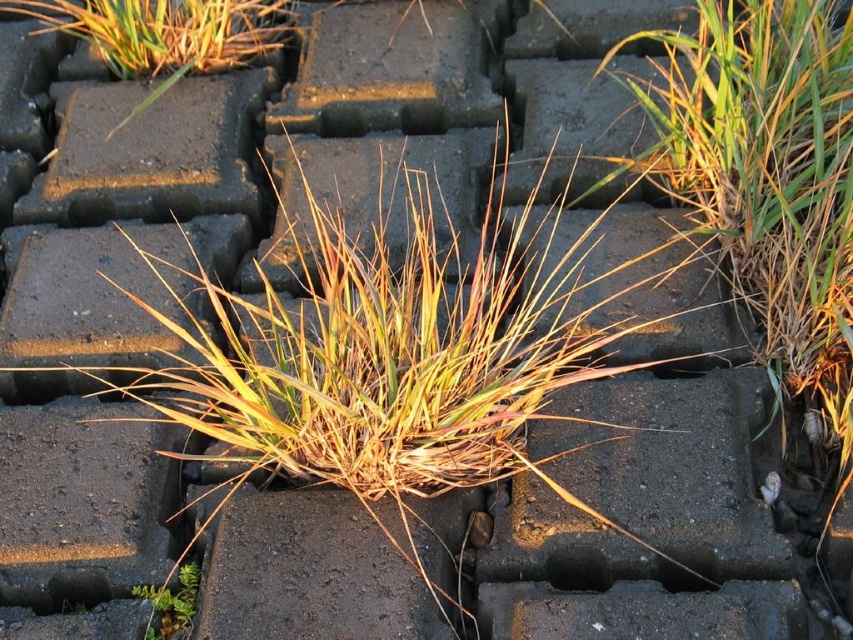
Is yellow-green grass at center further to the viewer compared to green matte plant at lower left?

No, it is in front of green matte plant at lower left.

Can you confirm if yellow-green grass at center is positioned to the left of green matte plant at lower left?

In fact, yellow-green grass at center is to the right of green matte plant at lower left.

Find the location of a particular element. This screenshot has width=853, height=640. yellow-green grass at center is located at coordinates (383, 371).

In order to click on yellow-green grass at center in this screenshot , I will do `click(383, 371)`.

Does yellow-green grass at center appear over yellow-green grass at upper left?

No.

Is yellow-green grass at center to the right of yellow-green grass at upper left from the viewer's perspective?

Indeed, yellow-green grass at center is positioned on the right side of yellow-green grass at upper left.

Locate an element on the screen. yellow-green grass at center is located at coordinates (383, 371).

Between yellow-green grass at upper left and green matte plant at lower left, which one is positioned higher?

yellow-green grass at upper left is above.

This screenshot has width=853, height=640. What do you see at coordinates (166, 33) in the screenshot?
I see `yellow-green grass at upper left` at bounding box center [166, 33].

Identify the location of yellow-green grass at upper left. This screenshot has width=853, height=640. (166, 33).